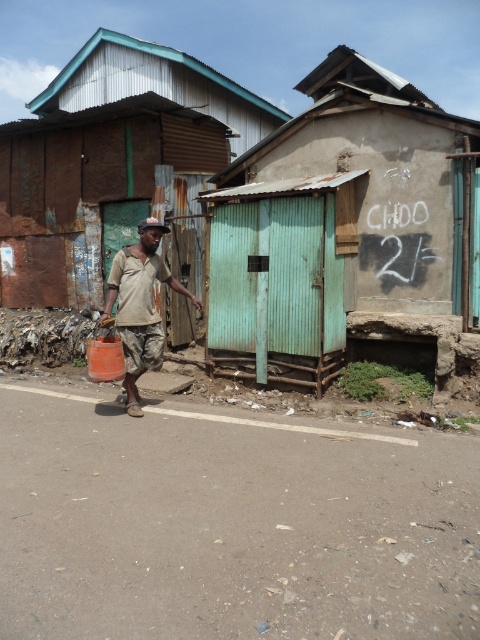
Is rusty corrugated metal hut at center behind camouflage pants at center?

Yes, it is.

Which is in front, point (154, 134) or point (151, 365)?

Point (151, 365) is more forward.

The image size is (480, 640). Identify the location of rusty corrugated metal hut at center. (109, 160).

Does green corrugated metal hut at center have a larger size compared to camouflage pants at center?

Indeed, green corrugated metal hut at center has a larger size compared to camouflage pants at center.

How distant is green corrugated metal hut at center from camouflage pants at center?

green corrugated metal hut at center is 2.24 meters from camouflage pants at center.

What do you see at coordinates (344, 227) in the screenshot?
I see `green corrugated metal hut at center` at bounding box center [344, 227].

You are a GUI agent. You are given a task and a screenshot of the screen. Output one action in this format:
    pyautogui.click(x=<x>, y=<y>)
    Task: Click on the green corrugated metal hut at center
    The height and width of the screenshot is (640, 480).
    Given the screenshot: What is the action you would take?
    pyautogui.click(x=344, y=227)

Based on the photo, can you confirm if green corrugated metal hut at center is taller than rusty corrugated metal hut at center?

No.

At what (x,y) coordinates should I click in order to perform the action: click on green corrugated metal hut at center. Please return your answer as a coordinate pair (x, y). The image size is (480, 640). Looking at the image, I should click on (344, 227).